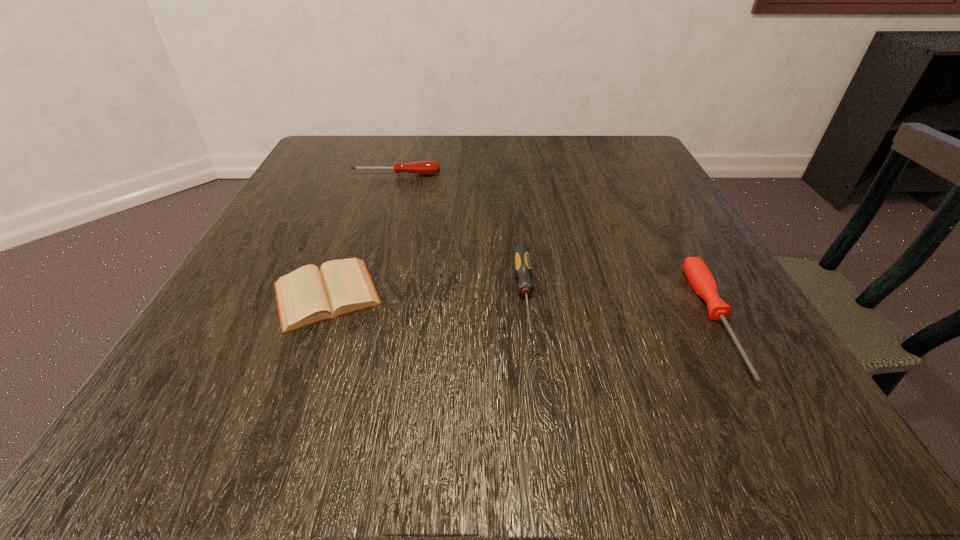
Where is `the farthest screwdriver`? the farthest screwdriver is located at coordinates (421, 167).

The height and width of the screenshot is (540, 960). Find the location of `the leftmost screwdriver`. the leftmost screwdriver is located at coordinates (421, 167).

Locate an element on the screen. The width and height of the screenshot is (960, 540). the rightmost screwdriver is located at coordinates (700, 278).

At what (x,y) coordinates should I click in order to perform the action: click on the second screwdriver from right to left. Please return your answer as a coordinate pair (x, y). The image size is (960, 540). Looking at the image, I should click on (523, 269).

I want to click on the shortest object, so click(x=308, y=295).

What are the coordinates of `free location located on the front of the farthest screwdriver` in the screenshot? It's located at (390, 198).

Find the location of a particular element. Image resolution: width=960 pixels, height=540 pixels. vacant region located 0.140m insert the second object from right to left into a screw head is located at coordinates (541, 438).

This screenshot has height=540, width=960. Find the location of `vacant space situated 0.160m on the right of the shortest object`. vacant space situated 0.160m on the right of the shortest object is located at coordinates (492, 293).

This screenshot has height=540, width=960. Identify the location of object positioned at the far edge. (421, 167).

This screenshot has height=540, width=960. What are the coordinates of `object at the near edge` in the screenshot? It's located at (700, 278).